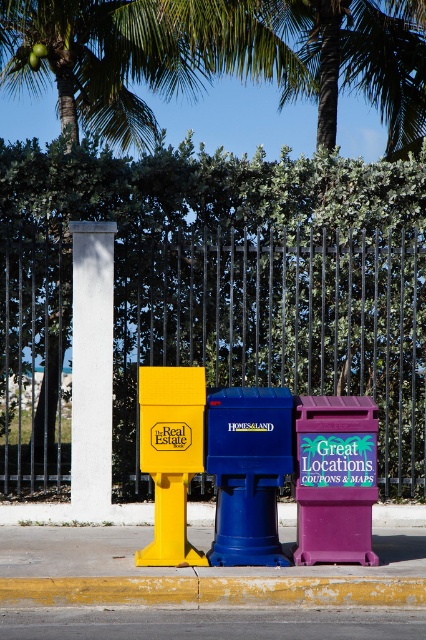
Is black metal fence at center bigger than blue plastic recycling bin at center?

Indeed, black metal fence at center has a larger size compared to blue plastic recycling bin at center.

Is point (167, 328) closer to camera compared to point (287, 417)?

No, (167, 328) is behind (287, 417).

The width and height of the screenshot is (426, 640). What are the coordinates of `black metal fence at center` in the screenshot? It's located at (276, 326).

From the picture: Is yellow painted concrete curb at lower center wider than matte yellow real estate box at center?

Yes, yellow painted concrete curb at lower center is wider than matte yellow real estate box at center.

Does yellow painted concrete curb at lower center come in front of matte yellow real estate box at center?

Yes, it is.

You are a GUI agent. You are given a task and a screenshot of the screen. Output one action in this format:
    pyautogui.click(x=<x>, y=<y>)
    Task: Click on the yellow painted concrete curb at lower center
    The height and width of the screenshot is (640, 426).
    Given the screenshot: What is the action you would take?
    pyautogui.click(x=213, y=589)

How far apart are blue plastic recycling bin at center and purple matte recycling bin at center?

33.11 centimeters

Which is behind, point (250, 561) or point (333, 474)?

Point (333, 474)

Identify the location of blue plastic recycling bin at center. This screenshot has height=640, width=426. (247, 472).